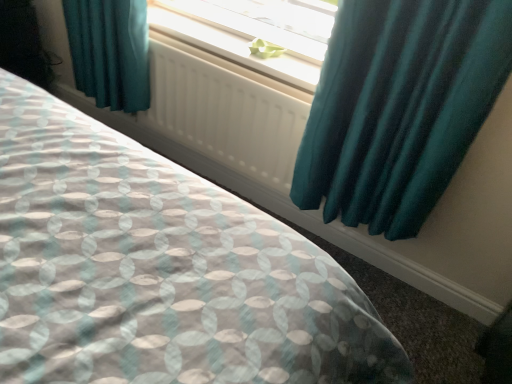
Question: Considering the relative sizes of white plastic radiator at upper center and teal satin curtain at upper right in the image provided, is white plastic radiator at upper center bigger than teal satin curtain at upper right?

Choices:
 (A) yes
 (B) no

Answer: (B)

Question: Considering the relative sizes of white plastic radiator at upper center and teal satin curtain at upper right in the image provided, is white plastic radiator at upper center wider than teal satin curtain at upper right?

Choices:
 (A) no
 (B) yes

Answer: (A)

Question: Is white plastic radiator at upper center in front of teal satin curtain at upper right?

Choices:
 (A) yes
 (B) no

Answer: (B)

Question: Would you consider white plastic radiator at upper center to be distant from teal satin curtain at upper right?

Choices:
 (A) yes
 (B) no

Answer: (B)

Question: Considering the relative sizes of white plastic radiator at upper center and teal satin curtain at upper right in the image provided, is white plastic radiator at upper center taller than teal satin curtain at upper right?

Choices:
 (A) yes
 (B) no

Answer: (B)

Question: Could you tell me if white plastic radiator at upper center is facing teal satin curtain at upper right?

Choices:
 (A) no
 (B) yes

Answer: (A)

Question: Is the position of green paper at center more distant than that of white matte radiator at center?

Choices:
 (A) no
 (B) yes

Answer: (B)

Question: Are green paper at center and white matte radiator at center located far from each other?

Choices:
 (A) no
 (B) yes

Answer: (A)

Question: Considering the relative sizes of green paper at center and white matte radiator at center in the image provided, is green paper at center thinner than white matte radiator at center?

Choices:
 (A) yes
 (B) no

Answer: (B)

Question: Is white matte radiator at center completely or partially inside green paper at center?

Choices:
 (A) no
 (B) yes

Answer: (A)

Question: From a real-world perspective, is green paper at center physically below white matte radiator at center?

Choices:
 (A) no
 (B) yes

Answer: (A)

Question: From the image's perspective, would you say green paper at center is positioned over white matte radiator at center?

Choices:
 (A) no
 (B) yes

Answer: (B)

Question: Is teal satin curtain at upper right positioned in front of green paper at center?

Choices:
 (A) no
 (B) yes

Answer: (B)